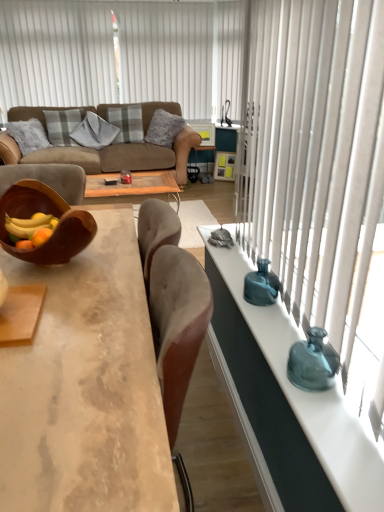
The image size is (384, 512). I want to click on vacant area that is in front of brown wooden bowl at left, so click(81, 300).